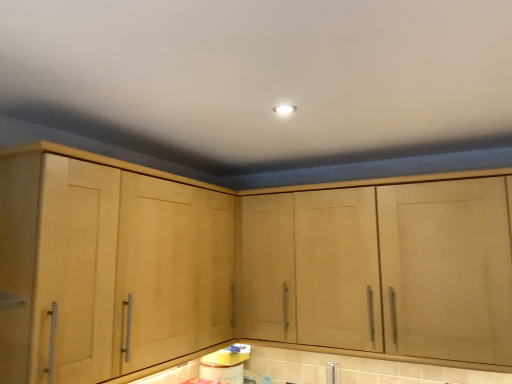
Question: From the image's perspective, is silver metallic faucet at lower center below light wood cabinet at center, which is the 2th cabinetry in left-to-right order?

Choices:
 (A) no
 (B) yes

Answer: (B)

Question: Can you confirm if silver metallic faucet at lower center is thinner than light wood cabinet at center, which ranks as the first cabinetry in right-to-left order?

Choices:
 (A) yes
 (B) no

Answer: (A)

Question: Is silver metallic faucet at lower center beside light wood cabinet at center, which is the 2th cabinetry in left-to-right order?

Choices:
 (A) yes
 (B) no

Answer: (B)

Question: Considering the relative sizes of silver metallic faucet at lower center and light wood cabinet at center, which is the 2th cabinetry in left-to-right order, in the image provided, is silver metallic faucet at lower center taller than light wood cabinet at center, which is the 2th cabinetry in left-to-right order,?

Choices:
 (A) no
 (B) yes

Answer: (A)

Question: Is silver metallic faucet at lower center positioned behind light wood cabinet at center, which is the 2th cabinetry in left-to-right order?

Choices:
 (A) no
 (B) yes

Answer: (B)

Question: Considering the relative sizes of silver metallic faucet at lower center and light wood cabinet at center, which ranks as the first cabinetry in right-to-left order, in the image provided, is silver metallic faucet at lower center bigger than light wood cabinet at center, which ranks as the first cabinetry in right-to-left order,?

Choices:
 (A) yes
 (B) no

Answer: (B)

Question: Can you confirm if light wood cabinet at center, which is the 2th cabinetry in left-to-right order, is bigger than silver metallic faucet at lower center?

Choices:
 (A) no
 (B) yes

Answer: (B)

Question: Does light wood cabinet at center, which ranks as the first cabinetry in right-to-left order, have a greater height compared to silver metallic faucet at lower center?

Choices:
 (A) no
 (B) yes

Answer: (B)

Question: Is light wood cabinet at center, which ranks as the first cabinetry in right-to-left order, positioned behind silver metallic faucet at lower center?

Choices:
 (A) no
 (B) yes

Answer: (A)

Question: From the image's perspective, is light wood cabinet at center, which is the 2th cabinetry in left-to-right order, on top of silver metallic faucet at lower center?

Choices:
 (A) no
 (B) yes

Answer: (B)

Question: From the image's perspective, is light wood cabinet at center, which ranks as the first cabinetry in right-to-left order, below silver metallic faucet at lower center?

Choices:
 (A) yes
 (B) no

Answer: (B)

Question: Is light wood cabinet at center, which ranks as the first cabinetry in right-to-left order, positioned in front of silver metallic faucet at lower center?

Choices:
 (A) yes
 (B) no

Answer: (A)

Question: Could you tell me if light wood cabinet at left, the 2th cabinetry positioned from the right, is turned towards silver metallic faucet at lower center?

Choices:
 (A) no
 (B) yes

Answer: (A)